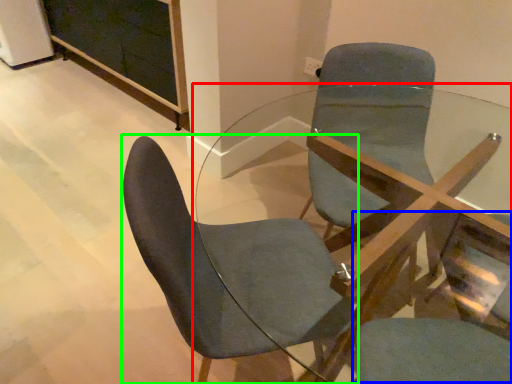
Question: Which is farther away from table (highlighted by a red box)? swivel chair (highlighted by a blue box) or chair (highlighted by a green box)?

Choices:
 (A) swivel chair
 (B) chair

Answer: (B)